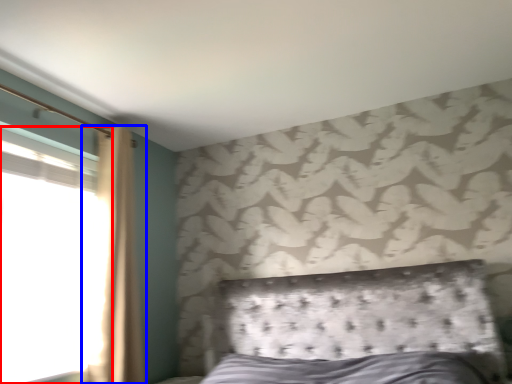
Question: Which of the following is the farthest to the observer, window (highlighted by a red box) or curtain (highlighted by a blue box)?

Choices:
 (A) window
 (B) curtain

Answer: (B)